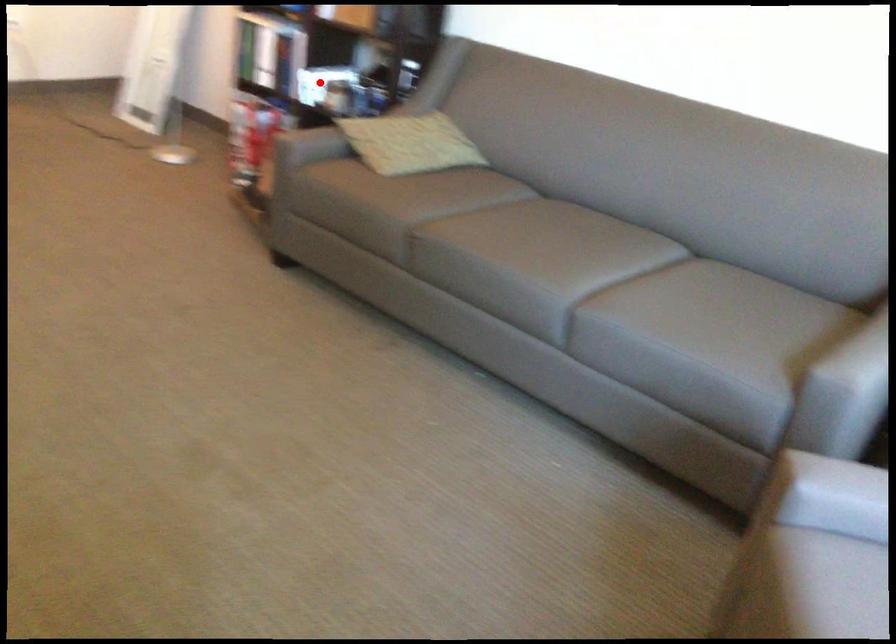
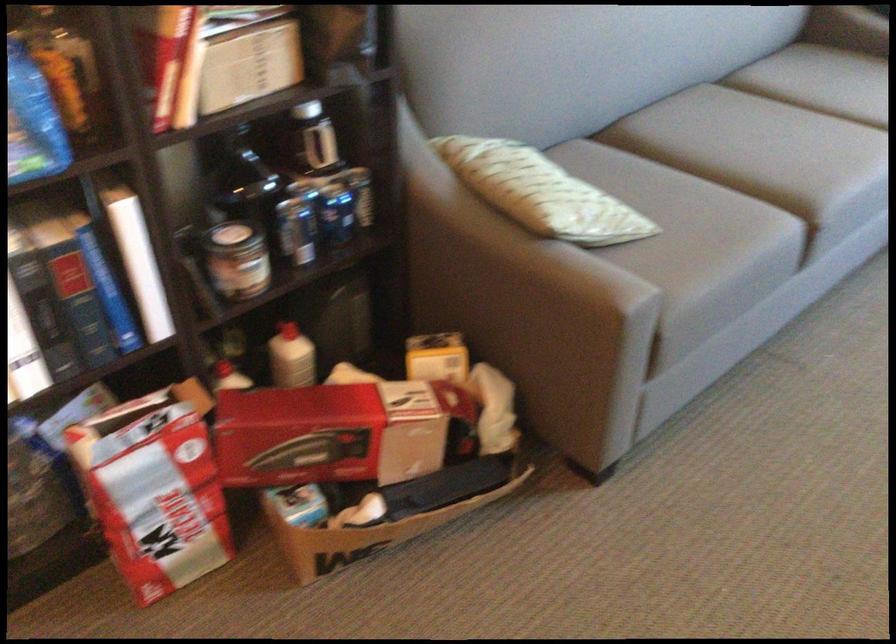
Question: I am providing you with two images of the same scene from different viewpoints. In image1, a red point is highlighted. Considering the same 3D point in image2, which of the following is correct?

Choices:
 (A) It is closer
 (B) It is farther

Answer: (A)